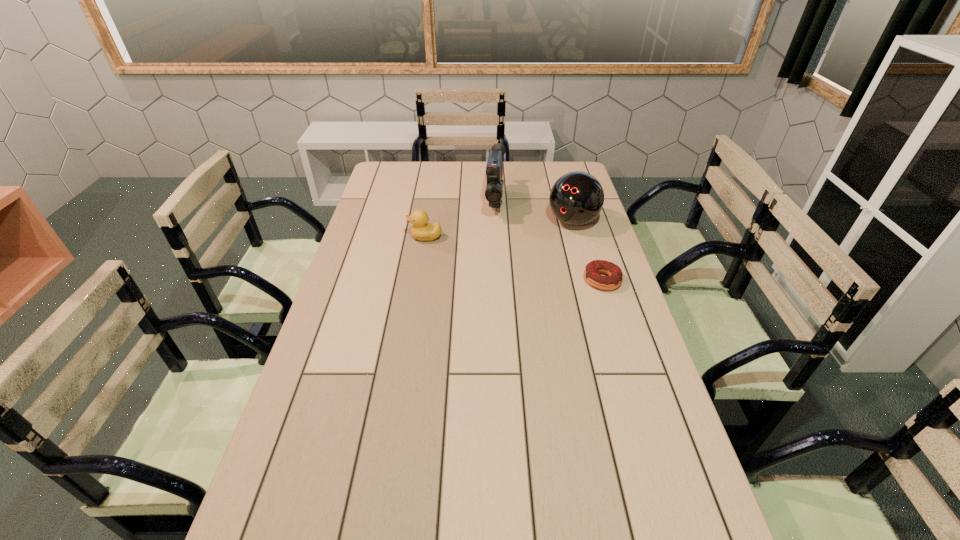
Locate an element on the screen. the leftmost object is located at coordinates (421, 230).

Identify the location of duckling. (421, 230).

I want to click on doughnut, so tap(591, 273).

Identify the location of the shortest object. (591, 273).

I want to click on bowling ball, so click(x=576, y=198).

Locate an element on the screen. The width and height of the screenshot is (960, 540). camcorder is located at coordinates (494, 170).

Identify the location of vacant point located 0.150m facing forward on the duckling. (368, 237).

The image size is (960, 540). Identify the location of vacant space located facing forward on the duckling. (363, 237).

Where is `free spot located 0.080m facing forward on the duckling`? free spot located 0.080m facing forward on the duckling is located at coordinates (x=387, y=237).

Identify the location of vacant space located 0.390m on the left of the nearest object. This screenshot has width=960, height=540. (466, 280).